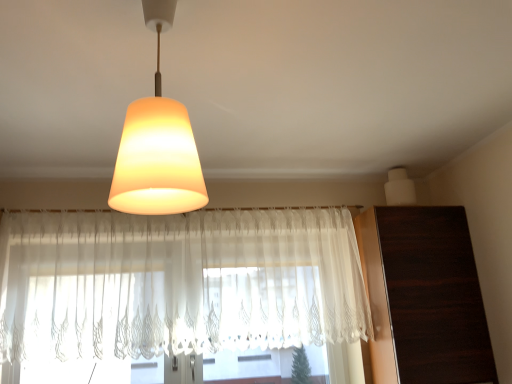
Question: From a real-world perspective, is white matte speaker at upper right, which appears as the 2th lamp when viewed from the front, on top of dark wood dresser at right?

Choices:
 (A) no
 (B) yes

Answer: (B)

Question: Is white matte speaker at upper right, acting as the 1th lamp starting from the right, positioned behind dark wood dresser at right?

Choices:
 (A) yes
 (B) no

Answer: (A)

Question: Is white matte speaker at upper right, which appears as the 2th lamp when viewed from the front, oriented away from dark wood dresser at right?

Choices:
 (A) yes
 (B) no

Answer: (B)

Question: Is white matte speaker at upper right, which appears as the 2th lamp when viewed from the front, not within dark wood dresser at right?

Choices:
 (A) yes
 (B) no

Answer: (A)

Question: Can you confirm if white matte speaker at upper right, the second lamp viewed from the left, is positioned to the right of dark wood dresser at right?

Choices:
 (A) yes
 (B) no

Answer: (B)

Question: Could you tell me if white matte speaker at upper right, the 1th lamp in the back-to-front sequence, is turned towards dark wood dresser at right?

Choices:
 (A) no
 (B) yes

Answer: (A)

Question: Is dark wood dresser at right facing away from matte glass lampshade at upper center, arranged as the first lamp when viewed from the left?

Choices:
 (A) yes
 (B) no

Answer: (B)

Question: Considering the relative positions of dark wood dresser at right and matte glass lampshade at upper center, which is counted as the first lamp, starting from the front, in the image provided, is dark wood dresser at right to the right of matte glass lampshade at upper center, which is counted as the first lamp, starting from the front, from the viewer's perspective?

Choices:
 (A) no
 (B) yes

Answer: (B)

Question: Does dark wood dresser at right come behind matte glass lampshade at upper center, arranged as the first lamp when viewed from the left?

Choices:
 (A) yes
 (B) no

Answer: (A)

Question: Does dark wood dresser at right have a greater width compared to matte glass lampshade at upper center, marked as the second lamp in a right-to-left arrangement?

Choices:
 (A) no
 (B) yes

Answer: (B)

Question: From the image's perspective, is dark wood dresser at right beneath matte glass lampshade at upper center, which is counted as the first lamp, starting from the front?

Choices:
 (A) yes
 (B) no

Answer: (A)

Question: Does dark wood dresser at right come in front of matte glass lampshade at upper center, marked as the second lamp in a right-to-left arrangement?

Choices:
 (A) no
 (B) yes

Answer: (A)

Question: Considering the relative sizes of white sheer curtain at center and matte glass lampshade at upper center, marked as the second lamp in a right-to-left arrangement, in the image provided, is white sheer curtain at center taller than matte glass lampshade at upper center, marked as the second lamp in a right-to-left arrangement,?

Choices:
 (A) no
 (B) yes

Answer: (B)